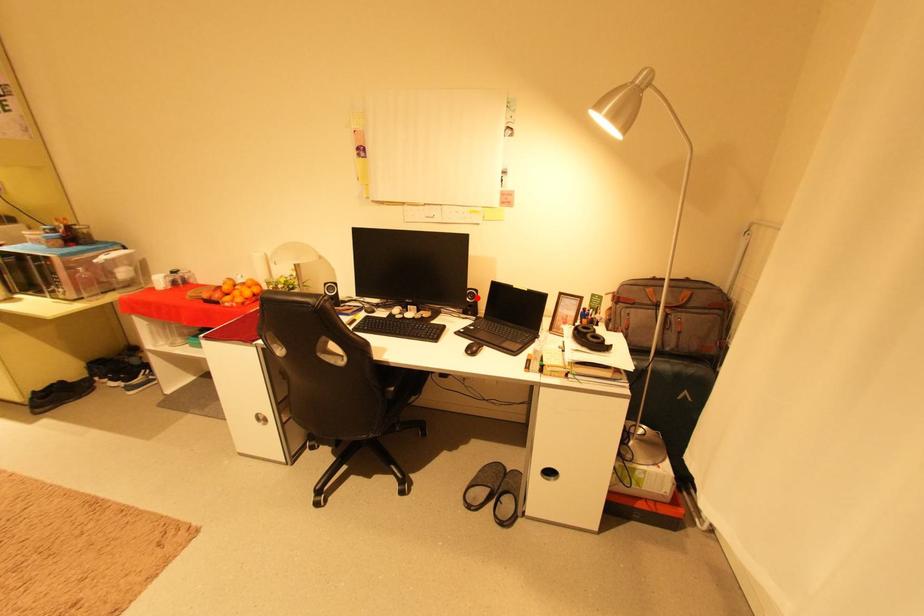
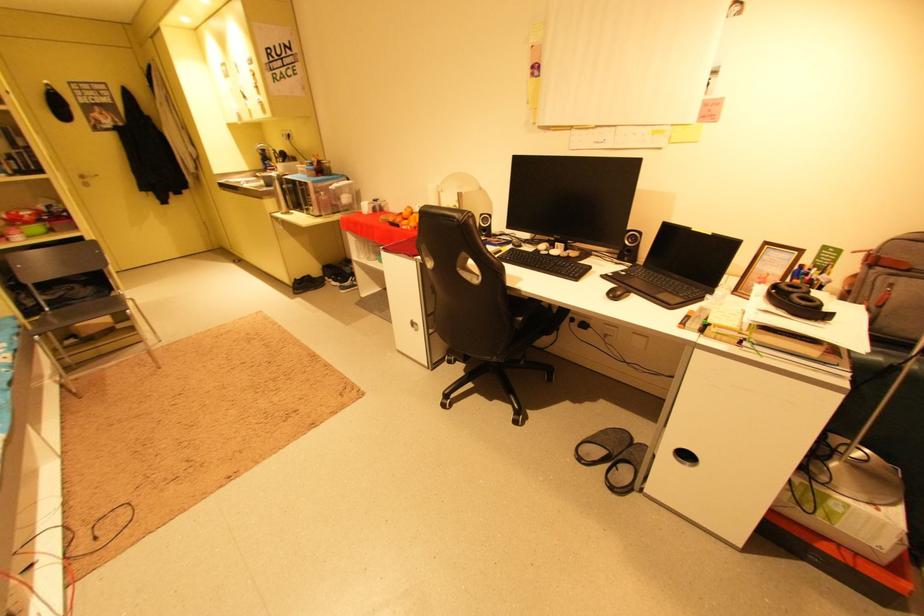
Where in the second image is the point corresponding to the highlighted location from the first image?

(638, 241)